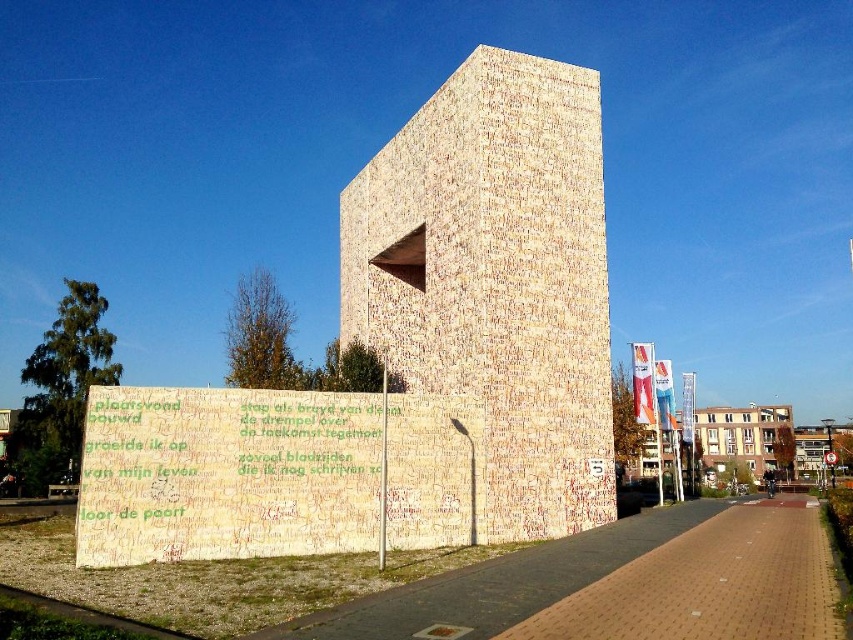
Question: Is beige textured wall at center closer to the viewer compared to white brick building at center?

Choices:
 (A) no
 (B) yes

Answer: (B)

Question: Among these objects, which one is nearest to the camera?

Choices:
 (A) white brick building at center
 (B) beige textured wall at center

Answer: (B)

Question: Can you confirm if beige textured wall at center is positioned to the left of white brick building at center?

Choices:
 (A) no
 (B) yes

Answer: (B)

Question: Which of the following is the farthest from the observer?

Choices:
 (A) (566, 164)
 (B) (740, 426)

Answer: (B)

Question: Which point is farther to the camera?

Choices:
 (A) (782, 451)
 (B) (601, 179)

Answer: (A)

Question: Can you confirm if beige textured wall at center is positioned to the left of white brick building at center?

Choices:
 (A) yes
 (B) no

Answer: (A)